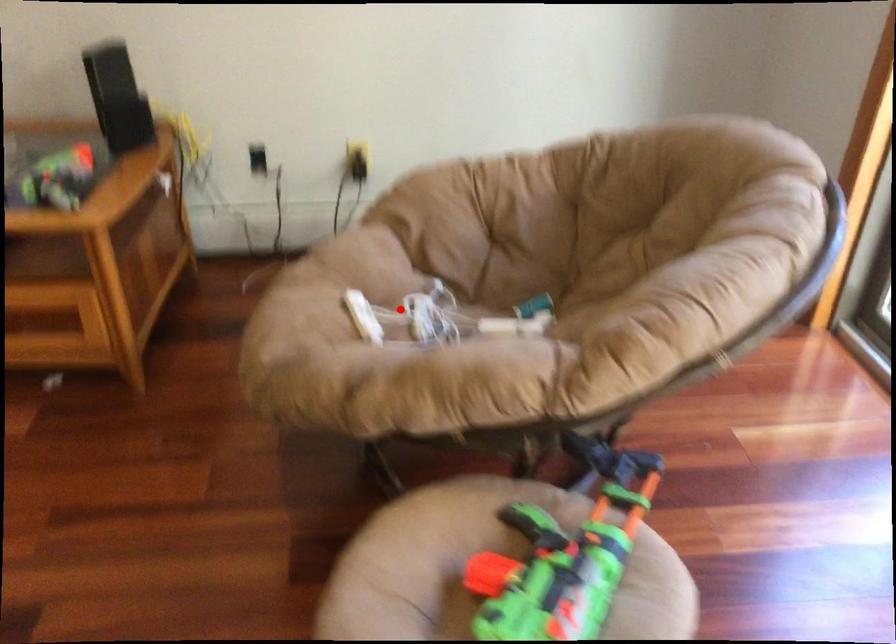
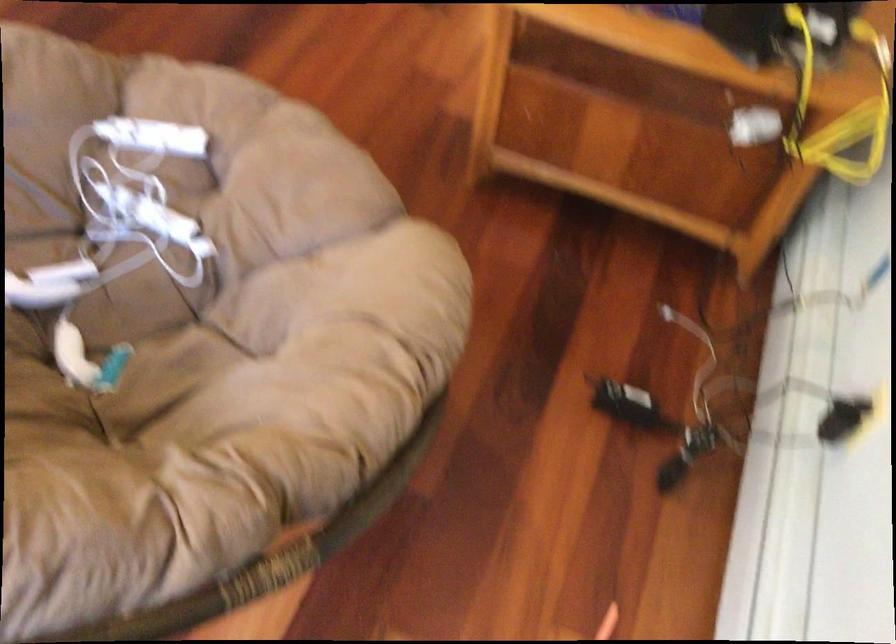
Find the pixel in the second image that matches the highlighted location in the first image.

(181, 205)